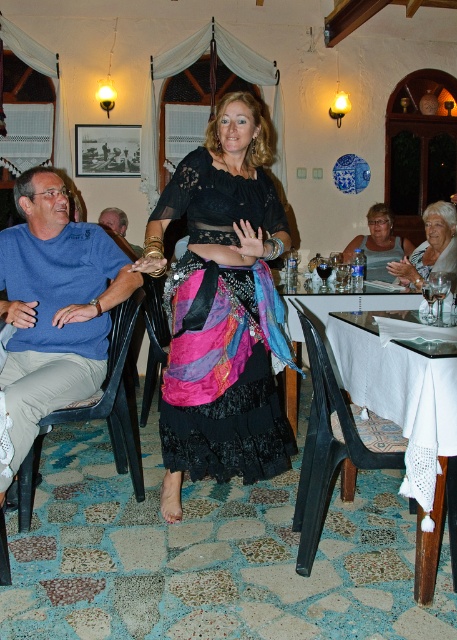
Is white cloth-covered table at center shorter than blue cotton shirt at left?

Incorrect, white cloth-covered table at center's height does not fall short of blue cotton shirt at left's.

Can you confirm if white cloth-covered table at center is wider than blue cotton shirt at left?

Yes, white cloth-covered table at center is wider than blue cotton shirt at left.

Which is in front, point (290, 289) or point (109, 211)?

Positioned in front is point (290, 289).

This screenshot has width=457, height=640. I want to click on white cloth-covered table at center, so 331,304.

Which is more to the right, black lace blouse at center or matte gray tank top at center?

Positioned to the right is matte gray tank top at center.

Which is in front, point (194, 236) or point (362, 243)?

Positioned in front is point (194, 236).

Between point (163, 216) and point (383, 218), which one is positioned in front?

Point (163, 216) is more forward.

Locate an element on the screen. This screenshot has height=640, width=457. black lace blouse at center is located at coordinates (221, 307).

Is black plastic chair at left wider than blue cotton shirt at left?

Correct, the width of black plastic chair at left exceeds that of blue cotton shirt at left.

Can you confirm if black plastic chair at left is shorter than blue cotton shirt at left?

In fact, black plastic chair at left may be taller than blue cotton shirt at left.

The height and width of the screenshot is (640, 457). Describe the element at coordinates (113, 396) in the screenshot. I see `black plastic chair at left` at that location.

At what (x,y) coordinates should I click in order to perform the action: click on black plastic chair at left. Please return your answer as a coordinate pair (x, y). Looking at the image, I should click on (113, 396).